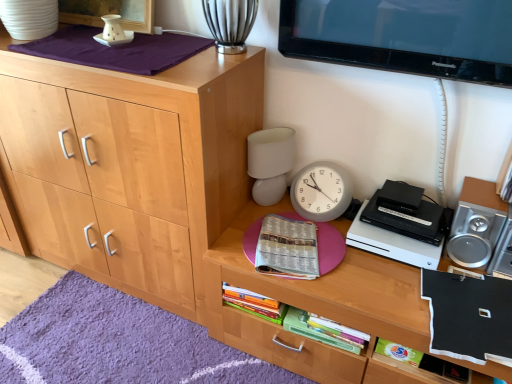
Question: From the image's perspective, does purple soft rug at lower left appear lower than natural wood cabinet at left?

Choices:
 (A) no
 (B) yes

Answer: (B)

Question: Can you confirm if purple soft rug at lower left is smaller than natural wood cabinet at left?

Choices:
 (A) yes
 (B) no

Answer: (A)

Question: Can you confirm if purple soft rug at lower left is thinner than natural wood cabinet at left?

Choices:
 (A) yes
 (B) no

Answer: (B)

Question: Is purple soft rug at lower left touching natural wood cabinet at left?

Choices:
 (A) yes
 (B) no

Answer: (B)

Question: Is purple soft rug at lower left further to camera compared to natural wood cabinet at left?

Choices:
 (A) no
 (B) yes

Answer: (B)

Question: From a real-world perspective, is purple soft rug at lower left beneath natural wood cabinet at left?

Choices:
 (A) no
 (B) yes

Answer: (B)

Question: From the image's perspective, would you say wooden desk at center is shown under black matte book at lower right, the 3th book from the left?

Choices:
 (A) yes
 (B) no

Answer: (A)

Question: Is wooden desk at center facing away from black matte book at lower right, acting as the 1th book starting from the right?

Choices:
 (A) no
 (B) yes

Answer: (A)

Question: Does wooden desk at center have a greater height compared to black matte book at lower right, the 3th book from the left?

Choices:
 (A) yes
 (B) no

Answer: (A)

Question: Is wooden desk at center in contact with black matte book at lower right, the 3th book from the left?

Choices:
 (A) no
 (B) yes

Answer: (A)

Question: From the image's perspective, is wooden desk at center on top of black matte book at lower right, the 3th book from the left?

Choices:
 (A) no
 (B) yes

Answer: (A)

Question: Does wooden desk at center appear on the left side of black matte book at lower right, the 3th book from the left?

Choices:
 (A) yes
 (B) no

Answer: (A)

Question: Does purple soft rug at lower left have a smaller size compared to black plastic dvd player at right?

Choices:
 (A) no
 (B) yes

Answer: (A)